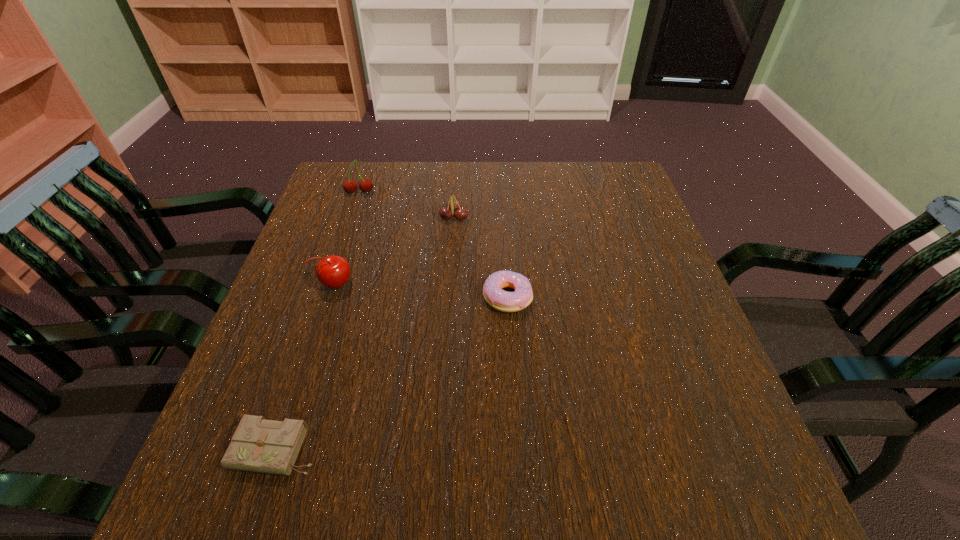
Locate an element on the screen. The image size is (960, 540). the farthest object is located at coordinates (365, 185).

Locate an element on the screen. The width and height of the screenshot is (960, 540). the nearest cherry is located at coordinates (333, 271).

Where is `the second shortest cherry`? The width and height of the screenshot is (960, 540). the second shortest cherry is located at coordinates (333, 271).

Find the location of a particular element. the rightmost cherry is located at coordinates (453, 206).

The image size is (960, 540). What are the coordinates of `the shortest cherry` in the screenshot? It's located at (453, 206).

Where is `doughnut`? The height and width of the screenshot is (540, 960). doughnut is located at coordinates (501, 300).

Locate an element on the screen. This screenshot has height=540, width=960. the second shortest object is located at coordinates (501, 300).

Identify the location of the nearest object. (258, 445).

The height and width of the screenshot is (540, 960). In order to click on the shortest object in this screenshot , I will do `click(258, 445)`.

Where is `free space located on the surface of the farthest cherry`? The width and height of the screenshot is (960, 540). free space located on the surface of the farthest cherry is located at coordinates (352, 213).